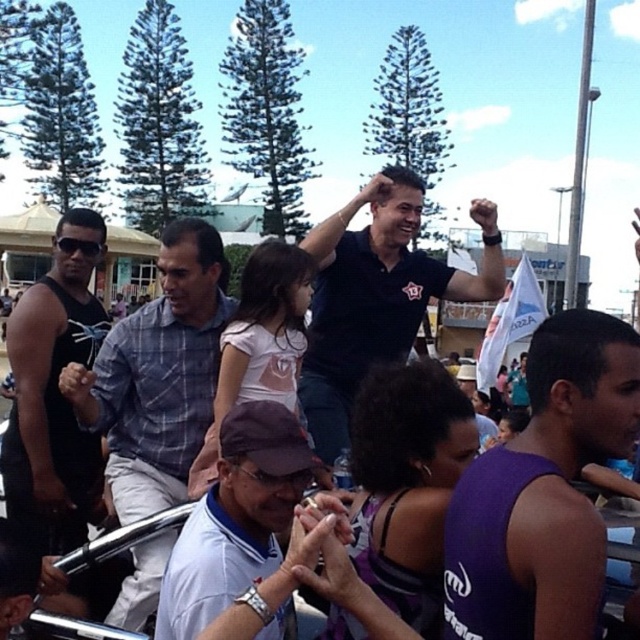
Question: Can you confirm if blue plaid shirt at center is positioned to the left of black matte tank top at left?

Choices:
 (A) no
 (B) yes

Answer: (A)

Question: Which point is farther from the camera taking this photo?

Choices:
 (A) (420, 294)
 (B) (532, 428)
 (C) (260, 417)

Answer: (A)

Question: Considering the relative positions of purple sleeveless shirt at center and dark blue shirt at center in the image provided, where is purple sleeveless shirt at center located with respect to dark blue shirt at center?

Choices:
 (A) above
 (B) below

Answer: (B)

Question: Which is farther from the blue plaid shirt at center?

Choices:
 (A) purple sleeveless shirt at center
 (B) dark blue shirt at center

Answer: (B)

Question: Among these objects, which one is nearest to the camera?

Choices:
 (A) dark blue shirt at center
 (B) white matte cap at center
 (C) blue plaid shirt at center

Answer: (B)

Question: Where is blue plaid shirt at center located in relation to white matte cap at center in the image?

Choices:
 (A) above
 (B) below

Answer: (B)